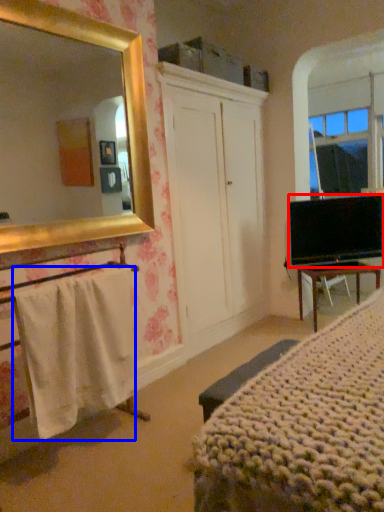
Question: Which of the following is the closest to the observer, television (highlighted by a red box) or towel/napkin (highlighted by a blue box)?

Choices:
 (A) television
 (B) towel/napkin

Answer: (B)